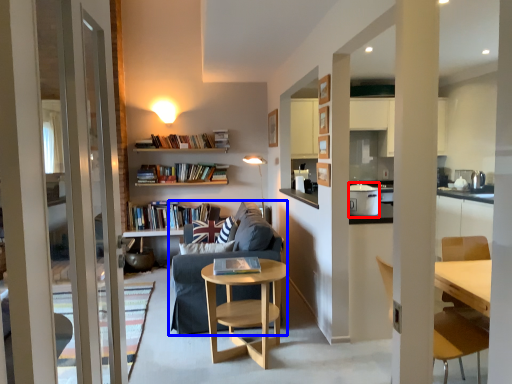
Question: Which of the following is the closest to the observer, appliance (highlighted by a red box) or studio couch (highlighted by a blue box)?

Choices:
 (A) appliance
 (B) studio couch

Answer: (A)